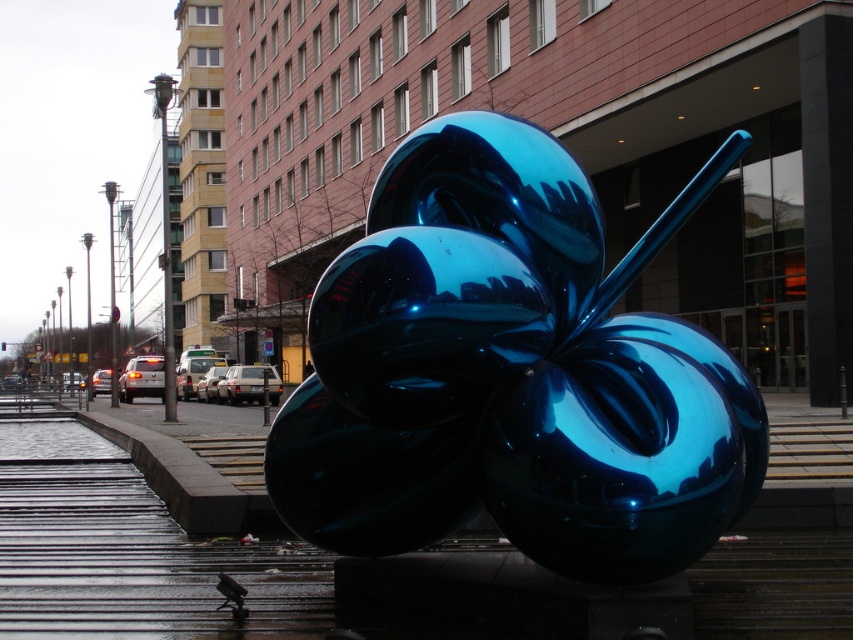
You are a city planner who needs to install a new bench in the park. The bench requires a minimum of 5 meters of space between it and any existing structures. If you place the bench at the location where the glossy concrete pavement at center is, will it comply with the spacing requirements considering the glossy metallic sculpture at center?

The distance between the glossy metallic sculpture at center and the glossy concrete pavement at center is 7.10 meters. Since the bench requires a minimum of 5 meters of space, placing it at the glossy concrete pavement at center location would comply with the requirements as 7.10 meters exceeds the 5 meters minimum.

You are a city planner assessing the placement of the glossy metallic sculpture at center and the glossy concrete pavement at center. Which object is positioned higher in the scene?

The glossy metallic sculpture at center is located above the glossy concrete pavement at center, so it is positioned higher.